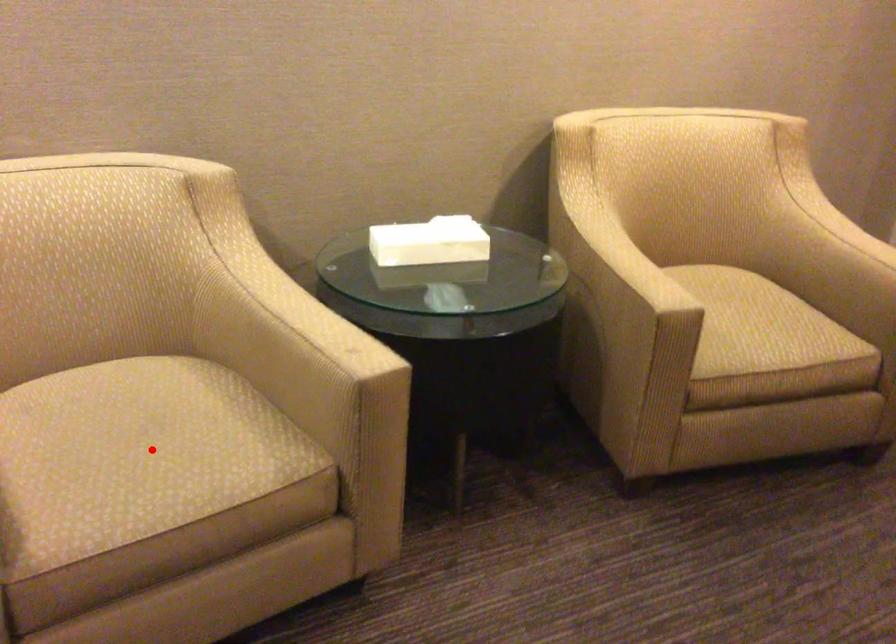
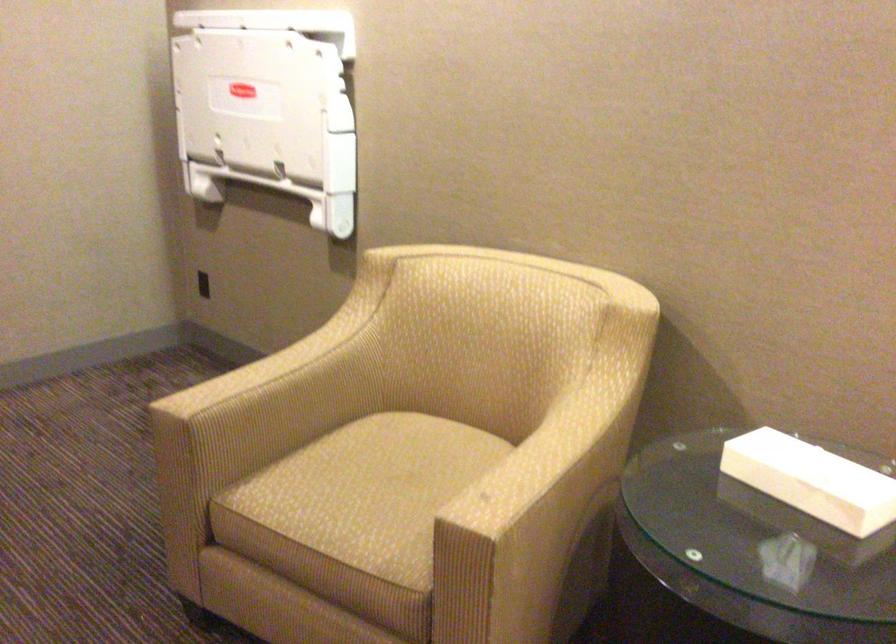
Question: I am providing you with two images of the same scene from different viewpoints. In image1, a red point is highlighted. Considering the same 3D point in image2, which of the following is correct?

Choices:
 (A) It is closer
 (B) It is farther

Answer: (B)